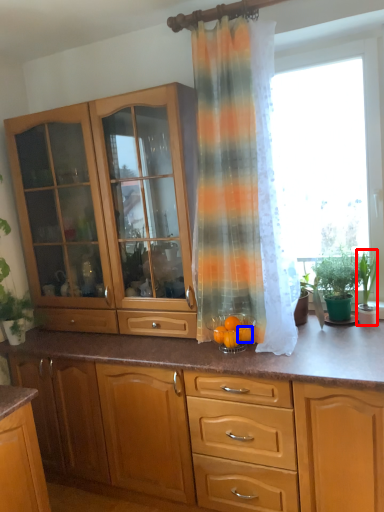
Question: Among these objects, which one is farthest to the camera, houseplant (highlighted by a red box) or orange (highlighted by a blue box)?

Choices:
 (A) houseplant
 (B) orange

Answer: (A)